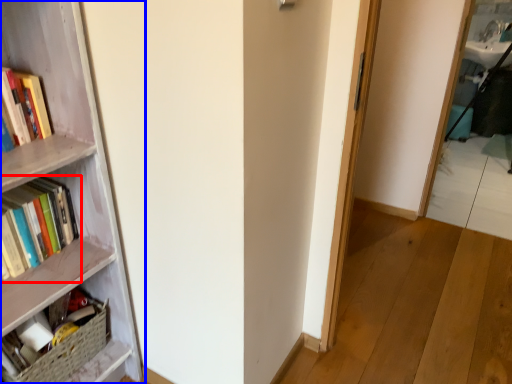
Question: Which point is closer to the camera, book (highlighted by a red box) or bookcase (highlighted by a blue box)?

Choices:
 (A) book
 (B) bookcase

Answer: (B)